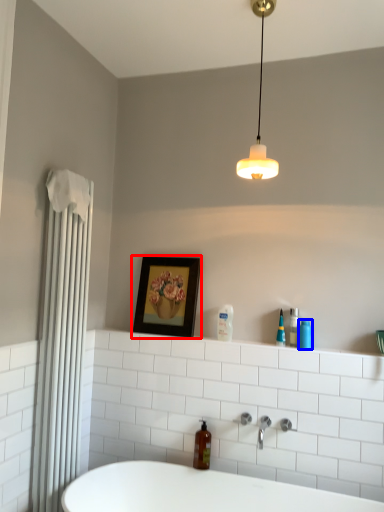
Question: Among these objects, which one is farthest to the camera, picture frame (highlighted by a red box) or toiletry (highlighted by a blue box)?

Choices:
 (A) picture frame
 (B) toiletry

Answer: (A)